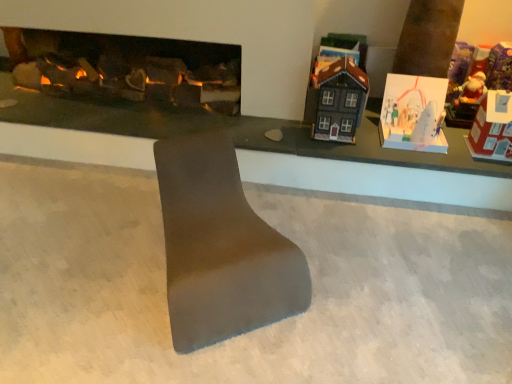
What do you see at coordinates (253, 151) in the screenshot?
I see `matte gray table at center` at bounding box center [253, 151].

I want to click on red cardboard house at right, which is counted as the first toy, starting from the right, so click(492, 127).

Considering the relative sizes of matte gray footrest at center and matte gray table at center in the image provided, is matte gray footrest at center bigger than matte gray table at center?

Yes, matte gray footrest at center is bigger than matte gray table at center.

How distant is matte gray footrest at center from matte gray table at center?

77.64 centimeters.

What's the angular difference between matte gray footrest at center and matte gray table at center's facing directions?

There is a 31.8-degree angle between the facing directions of matte gray footrest at center and matte gray table at center.

From the image's perspective, between matte gray footrest at center and matte gray table at center, which one is located above?

matte gray table at center.

From a real-world perspective, is red cardboard house at right, which is counted as the first toy, starting from the right, positioned over dark gray matte house at upper right, arranged as the fourth toy when viewed from the right, based on gravity?

No, from a real-world perspective, red cardboard house at right, which is counted as the first toy, starting from the right, is not over dark gray matte house at upper right, arranged as the fourth toy when viewed from the right

Considering the relative positions of red cardboard house at right, which is counted as the first toy, starting from the right, and dark gray matte house at upper right, the first toy in the left-to-right sequence, in the image provided, is red cardboard house at right, which is counted as the first toy, starting from the right, to the left of dark gray matte house at upper right, the first toy in the left-to-right sequence, from the viewer's perspective?

Incorrect, red cardboard house at right, which is counted as the first toy, starting from the right, is not on the left side of dark gray matte house at upper right, the first toy in the left-to-right sequence.

Consider the image. Can you see red cardboard house at right, placed as the 4th toy when sorted from left to right, touching dark gray matte house at upper right, the first toy in the left-to-right sequence?

No, red cardboard house at right, placed as the 4th toy when sorted from left to right, is not making contact with dark gray matte house at upper right, the first toy in the left-to-right sequence.

Is red cardboard house at right, placed as the 4th toy when sorted from left to right, located outside dark gray matte house at upper right, arranged as the fourth toy when viewed from the right?

Yes, red cardboard house at right, placed as the 4th toy when sorted from left to right, is not within dark gray matte house at upper right, arranged as the fourth toy when viewed from the right.

From a real-world perspective, which is physically above, white paper card at upper right, acting as the second toy starting from the right, or red cardboard house at right, placed as the 4th toy when sorted from left to right?

red cardboard house at right, placed as the 4th toy when sorted from left to right, is physically above.

Considering the positions of objects white paper card at upper right, acting as the second toy starting from the right, and red cardboard house at right, which is counted as the first toy, starting from the right, in the image provided, who is behind, white paper card at upper right, acting as the second toy starting from the right, or red cardboard house at right, which is counted as the first toy, starting from the right,?

white paper card at upper right, acting as the second toy starting from the right.

Which of these two, white paper card at upper right, acting as the second toy starting from the right, or red cardboard house at right, which is counted as the first toy, starting from the right, is bigger?

Bigger between the two is white paper card at upper right, acting as the second toy starting from the right.

Is smooth gray concrete at center wider or thinner than matte gray table at center?

Considering their sizes, smooth gray concrete at center looks broader than matte gray table at center.

Could you tell me if smooth gray concrete at center is turned towards matte gray table at center?

No, smooth gray concrete at center is not facing towards matte gray table at center.

Is smooth gray concrete at center shorter than matte gray table at center?

No, smooth gray concrete at center is not shorter than matte gray table at center.

Is white paper card at upper right, the 3th toy in the left-to-right sequence, not near smooth gray concrete at center?

white paper card at upper right, the 3th toy in the left-to-right sequence, is actually quite close to smooth gray concrete at center.

From the picture: Considering the sizes of objects white paper card at upper right, acting as the second toy starting from the right, and smooth gray concrete at center in the image provided, who is bigger, white paper card at upper right, acting as the second toy starting from the right, or smooth gray concrete at center?

With larger size is smooth gray concrete at center.

Considering the positions of objects white paper card at upper right, the 3th toy in the left-to-right sequence, and smooth gray concrete at center in the image provided, who is more to the right, white paper card at upper right, the 3th toy in the left-to-right sequence, or smooth gray concrete at center?

From the viewer's perspective, white paper card at upper right, the 3th toy in the left-to-right sequence, appears more on the right side.

Considering the sizes of objects white paper card at upper right, the 3th toy in the left-to-right sequence, and smooth gray concrete at center in the image provided, who is thinner, white paper card at upper right, the 3th toy in the left-to-right sequence, or smooth gray concrete at center?

white paper card at upper right, the 3th toy in the left-to-right sequence.

Which object is positioned more to the left, matte gray table at center or matte black house at upper right, placed as the 2th toy when sorted from left to right?

matte gray table at center.

Could you measure the distance between matte gray table at center and matte black house at upper right, the third toy positioned from the right?

matte gray table at center is 25.36 inches from matte black house at upper right, the third toy positioned from the right.

How different are the orientations of matte gray table at center and matte black house at upper right, the third toy positioned from the right, in degrees?

The angle between the facing direction of matte gray table at center and the facing direction of matte black house at upper right, the third toy positioned from the right, is 5.88 degrees.

In the scene shown: From the image's perspective, would you say matte gray table at center is shown under matte black house at upper right, placed as the 2th toy when sorted from left to right?

Yes.

From the image's perspective, which is below, dark gray matte house at upper right, arranged as the fourth toy when viewed from the right, or matte black house at upper right, placed as the 2th toy when sorted from left to right?

dark gray matte house at upper right, arranged as the fourth toy when viewed from the right, is shown below in the image.

How much distance is there between dark gray matte house at upper right, the first toy in the left-to-right sequence, and matte black house at upper right, placed as the 2th toy when sorted from left to right?

The distance of dark gray matte house at upper right, the first toy in the left-to-right sequence, from matte black house at upper right, placed as the 2th toy when sorted from left to right, is 7.13 inches.

Between dark gray matte house at upper right, arranged as the fourth toy when viewed from the right, and matte black house at upper right, placed as the 2th toy when sorted from left to right, which one has larger width?

dark gray matte house at upper right, arranged as the fourth toy when viewed from the right, is wider.

From the picture: Is dark gray matte house at upper right, the first toy in the left-to-right sequence, not inside matte black house at upper right, placed as the 2th toy when sorted from left to right?

Yes.

The width and height of the screenshot is (512, 384). Identify the location of table on the left of matte gray footrest at center. (253, 151).

Where is `toy in front of the dark gray matte house at upper right, the first toy in the left-to-right sequence`? Image resolution: width=512 pixels, height=384 pixels. toy in front of the dark gray matte house at upper right, the first toy in the left-to-right sequence is located at coordinates tap(492, 127).

From the image, which object appears to be nearer to dark gray matte house at upper right, the first toy in the left-to-right sequence, matte gray table at center or matte black house at upper right, placed as the 2th toy when sorted from left to right?

matte black house at upper right, placed as the 2th toy when sorted from left to right, is closer to dark gray matte house at upper right, the first toy in the left-to-right sequence.

Estimate the real-world distances between objects in this image. Which object is closer to smooth gray concrete at center, matte black house at upper right, placed as the 2th toy when sorted from left to right, or matte gray footrest at center?

Based on the image, matte gray footrest at center appears to be nearer to smooth gray concrete at center.

Based on their spatial positions, is dark gray matte house at upper right, arranged as the fourth toy when viewed from the right, or matte black house at upper right, placed as the 2th toy when sorted from left to right, closer to matte gray footrest at center?

dark gray matte house at upper right, arranged as the fourth toy when viewed from the right, lies closer to matte gray footrest at center than the other object.

Considering their positions, is matte gray footrest at center positioned closer to red cardboard house at right, which is counted as the first toy, starting from the right, than matte gray table at center?

The object closer to red cardboard house at right, which is counted as the first toy, starting from the right, is matte gray table at center.

Looking at this image, when comparing their distances from white paper card at upper right, the 3th toy in the left-to-right sequence, does dark gray matte house at upper right, arranged as the fourth toy when viewed from the right, or matte gray footrest at center seem further?

matte gray footrest at center.

From the image, which object appears to be farther from red cardboard house at right, which is counted as the first toy, starting from the right, white paper card at upper right, acting as the second toy starting from the right, or matte gray footrest at center?

matte gray footrest at center is positioned further to the anchor red cardboard house at right, which is counted as the first toy, starting from the right.

Estimate the real-world distances between objects in this image. Which object is closer to matte black house at upper right, placed as the 2th toy when sorted from left to right, smooth gray concrete at center or matte gray footrest at center?

Among the two, matte gray footrest at center is located nearer to matte black house at upper right, placed as the 2th toy when sorted from left to right.

Considering their positions, is matte gray table at center positioned further to red cardboard house at right, placed as the 4th toy when sorted from left to right, than smooth gray concrete at center?

Based on the image, smooth gray concrete at center appears to be further to red cardboard house at right, placed as the 4th toy when sorted from left to right.

The image size is (512, 384). Find the location of `concrete between matte gray footrest at center and matte black house at upper right, the third toy positioned from the right, from front to back`. concrete between matte gray footrest at center and matte black house at upper right, the third toy positioned from the right, from front to back is located at coordinates (260, 328).

You are a GUI agent. You are given a task and a screenshot of the screen. Output one action in this format:
    pyautogui.click(x=<x>, y=<y>)
    Task: Click on the toy between dark gray matte house at upper right, the first toy in the left-to-right sequence, and matte black house at upper right, placed as the 2th toy when sorted from left to right, along the z-axis
    This screenshot has height=384, width=512.
    Given the screenshot: What is the action you would take?
    pyautogui.click(x=413, y=113)

Locate an element on the screen. concrete located between matte gray table at center and red cardboard house at right, placed as the 4th toy when sorted from left to right, in the left-right direction is located at coordinates (260, 328).

Locate an element on the screen. table positioned between smooth gray concrete at center and matte black house at upper right, the third toy positioned from the right, from near to far is located at coordinates (253, 151).